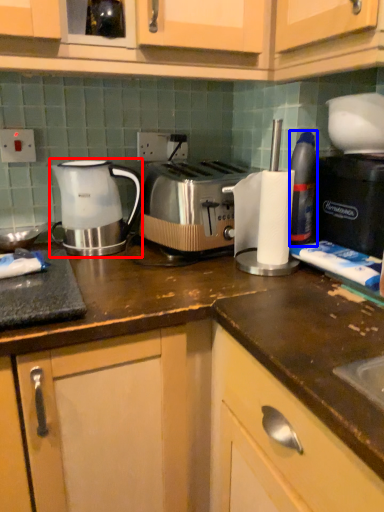
Question: Which of the following is the closest to the observer, kettle (highlighted by a red box) or bottle (highlighted by a blue box)?

Choices:
 (A) kettle
 (B) bottle

Answer: (B)